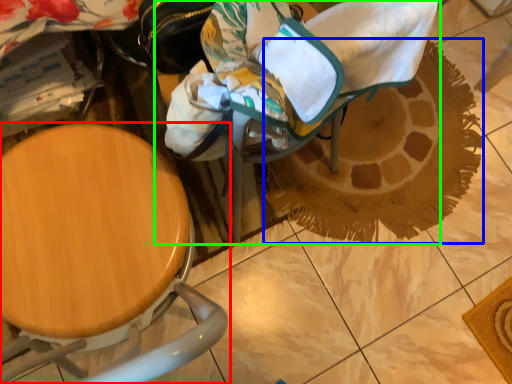
Question: Which object is the farthest from chair (highlighted by a red box)? Choose among these: doormat (highlighted by a blue box) or baby carriage (highlighted by a green box).

Choices:
 (A) doormat
 (B) baby carriage

Answer: (A)